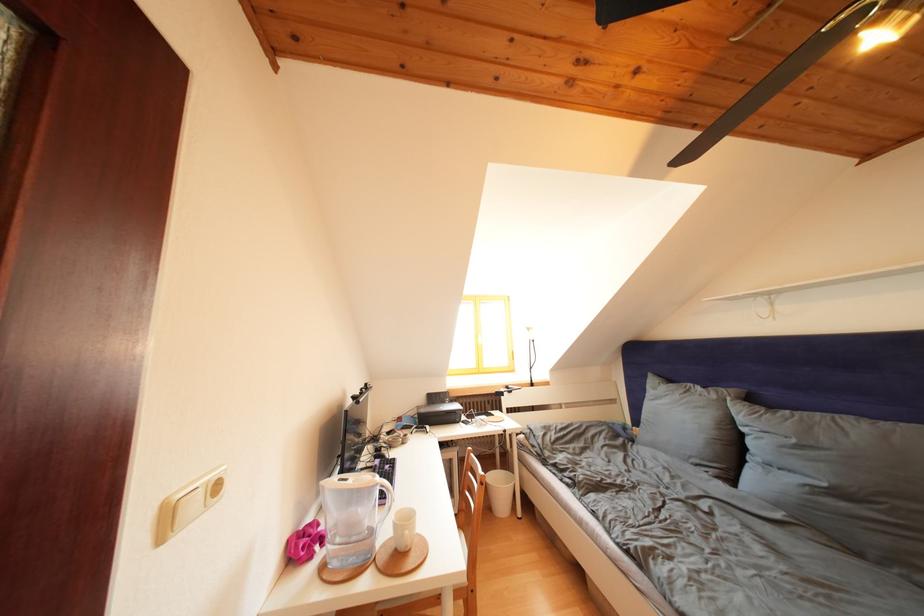
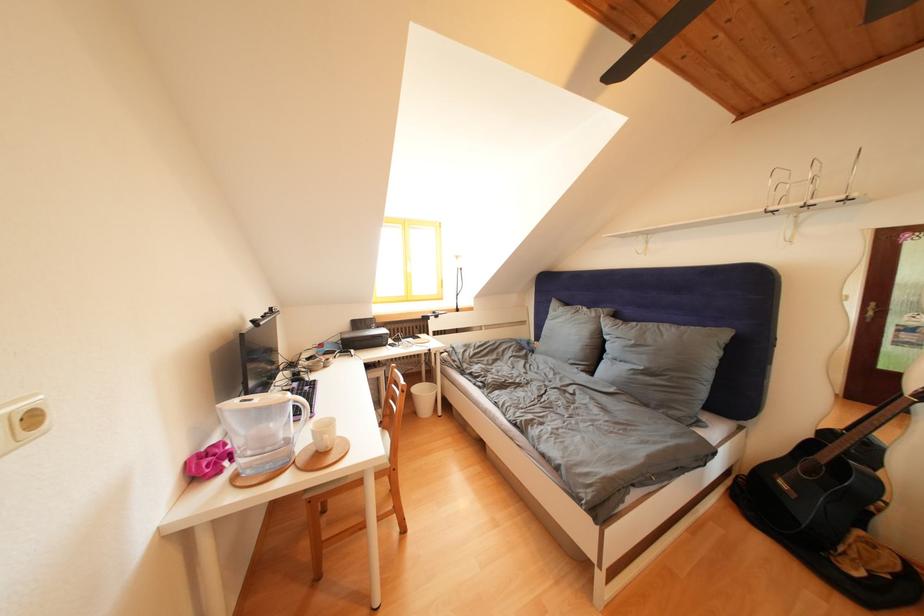
In the second image, find the point that corresponds to [503,472] in the first image.

(429, 387)